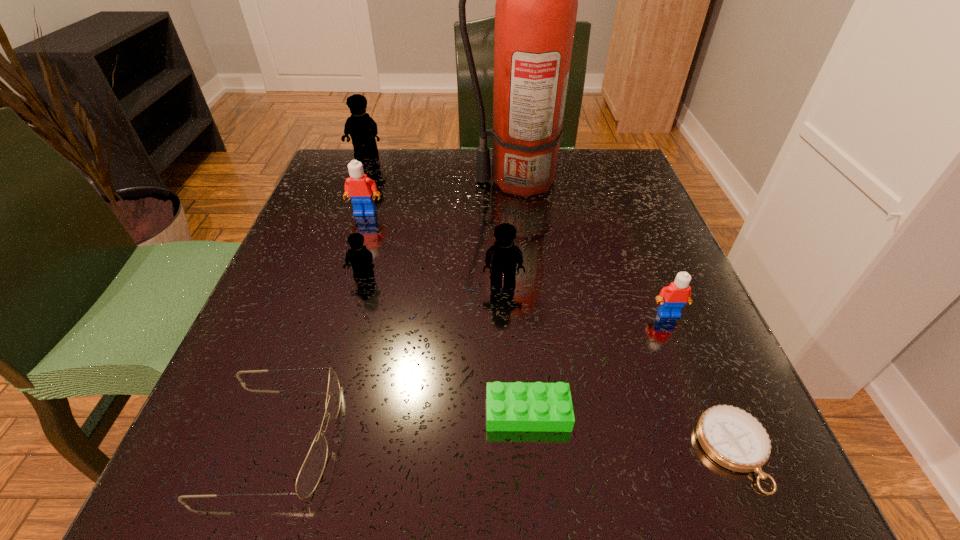
This screenshot has width=960, height=540. I want to click on free space at the left edge, so click(x=285, y=397).

The width and height of the screenshot is (960, 540). What are the coordinates of `free region at the right edge of the desktop` in the screenshot? It's located at (610, 214).

Locate an element on the screen. Image resolution: width=960 pixels, height=540 pixels. free space at the far left corner of the desktop is located at coordinates (388, 159).

This screenshot has width=960, height=540. I want to click on free space at the far right corner of the desktop, so click(x=592, y=151).

I want to click on empty space between the rightmost yellow Lego and the third shortest object, so click(x=389, y=359).

You are a GUI agent. You are given a task and a screenshot of the screen. Output one action in this format:
    pyautogui.click(x=<x>, y=<y>)
    Task: Click on the vacant space that is in between the second biggest yellow Lego and the rightmost Lego
    This screenshot has height=540, width=960.
    Given the screenshot: What is the action you would take?
    586,298

This screenshot has width=960, height=540. I want to click on free space between the tallest object and the second yellow Lego from left to right, so click(440, 228).

At what (x,y) coordinates should I click in order to perform the action: click on vacant point located between the farthest object and the shortest object. Please return your answer as a coordinate pair (x, y). The image size is (960, 540). Looking at the image, I should click on (550, 303).

Image resolution: width=960 pixels, height=540 pixels. I want to click on vacant space that is in between the compass and the second shortest object, so 631,431.

I want to click on vacant space that's between the second farthest object and the bigger white Lego, so click(x=441, y=197).